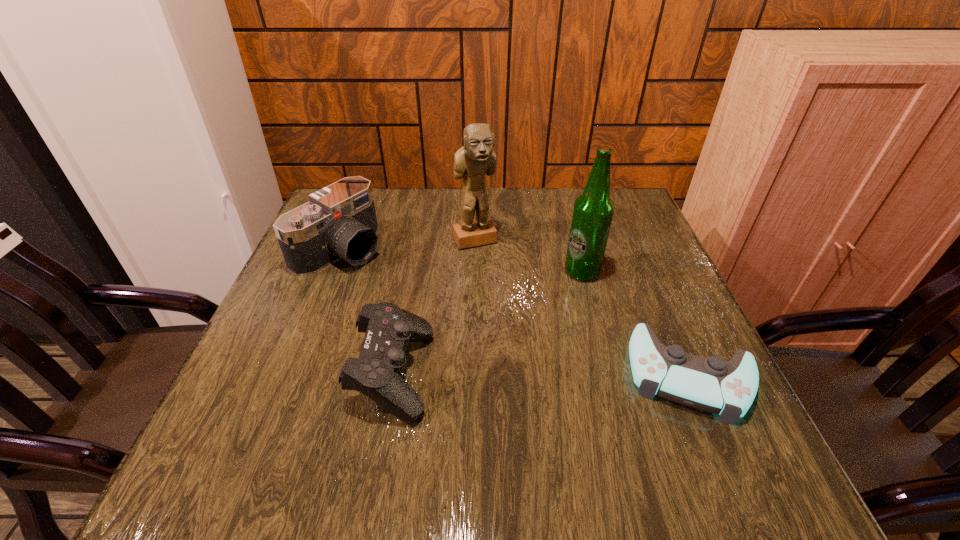
The width and height of the screenshot is (960, 540). I want to click on vacant space in between the figurine and the shorter control, so click(x=583, y=307).

You are a GUI agent. You are given a task and a screenshot of the screen. Output one action in this format:
    pyautogui.click(x=<x>, y=<y>)
    Task: Click on the free point between the figurine and the beer bottle
    
    Given the screenshot: What is the action you would take?
    pyautogui.click(x=528, y=255)

This screenshot has width=960, height=540. I want to click on free spot between the right control and the third object from right to left, so pos(583,307).

In order to click on free spot between the camera and the right control in this screenshot , I will do `click(516, 312)`.

Identify the location of free point between the beer bottle and the shorter control. The width and height of the screenshot is (960, 540). (636, 323).

Locate an element on the screen. Image resolution: width=960 pixels, height=540 pixels. vacant space in between the shortest object and the third tallest object is located at coordinates (516, 312).

The width and height of the screenshot is (960, 540). I want to click on free space that is in between the third object from left to right and the right control, so click(x=583, y=307).

Where is `vacant area that lies between the right control and the camera`? The width and height of the screenshot is (960, 540). vacant area that lies between the right control and the camera is located at coordinates (516, 312).

Where is `free space between the beer bottle and the third shortest object`? free space between the beer bottle and the third shortest object is located at coordinates (462, 260).

Identify which object is located as the nearest to the beer bottle. Please provide its 2D coordinates. Your answer should be formatted as a tuple, i.e. [(x, y)], where the tuple contains the x and y coordinates of a point satisfying the conditions above.

[(710, 384)]